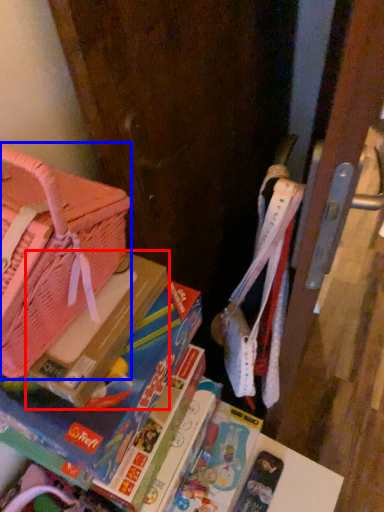
Question: Among these objects, which one is nearest to the camera, paperback book (highlighted by a red box) or handbag (highlighted by a blue box)?

Choices:
 (A) paperback book
 (B) handbag

Answer: (B)